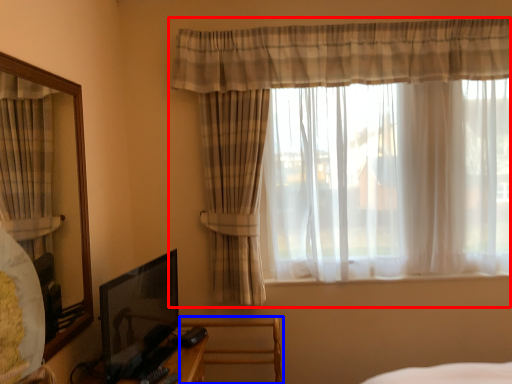
Question: Which of the following is the farthest to the observer, curtain (highlighted by a red box) or swivel chair (highlighted by a blue box)?

Choices:
 (A) curtain
 (B) swivel chair

Answer: (B)